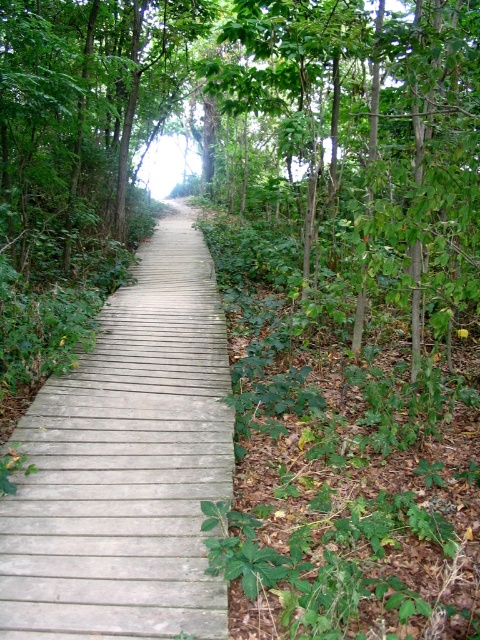
Question: Can you confirm if wooden planks at center is bigger than green leafy tree at center?

Choices:
 (A) no
 (B) yes

Answer: (B)

Question: From the image, what is the correct spatial relationship of wooden planks at center in relation to green leafy tree at center?

Choices:
 (A) left
 (B) right

Answer: (A)

Question: Which point is closer to the camera?

Choices:
 (A) (205, 348)
 (B) (419, 49)

Answer: (B)

Question: Does wooden planks at center have a lesser width compared to green leafy tree at center?

Choices:
 (A) no
 (B) yes

Answer: (A)

Question: Among these objects, which one is farthest from the camera?

Choices:
 (A) wooden planks at center
 (B) green leafy tree at center

Answer: (B)